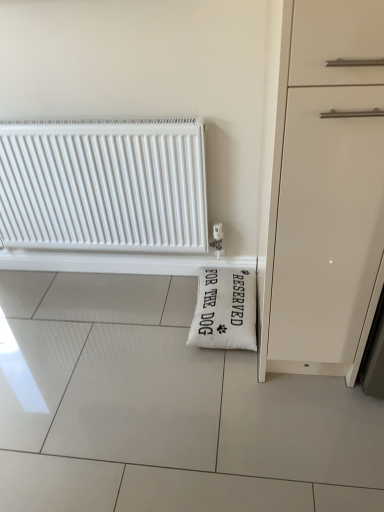
This screenshot has width=384, height=512. Describe the element at coordinates (104, 186) in the screenshot. I see `white plastic radiator at upper left` at that location.

At what (x,y) coordinates should I click in order to perform the action: click on white plastic radiator at upper left. Please return your answer as a coordinate pair (x, y). This screenshot has height=512, width=384. Looking at the image, I should click on (104, 186).

Identify the location of white fabric pillow at lower right. The height and width of the screenshot is (512, 384). (225, 310).

What do you see at coordinates (225, 310) in the screenshot? The width and height of the screenshot is (384, 512). I see `white fabric pillow at lower right` at bounding box center [225, 310].

Looking at this image, measure the distance between white fabric pillow at lower right and camera.

A distance of 5.60 feet exists between white fabric pillow at lower right and camera.

Measure the distance between point (208, 313) and camera.

A distance of 5.85 feet exists between point (208, 313) and camera.

The height and width of the screenshot is (512, 384). What are the coordinates of `white plastic radiator at upper left` in the screenshot? It's located at (104, 186).

Considering the relative positions of white fabric pillow at lower right and white plastic radiator at upper left in the image provided, is white fabric pillow at lower right to the left of white plastic radiator at upper left from the viewer's perspective?

In fact, white fabric pillow at lower right is to the right of white plastic radiator at upper left.

Between white fabric pillow at lower right and white plastic radiator at upper left, which one is positioned behind?

white fabric pillow at lower right is further from the camera.

Between point (234, 273) and point (116, 243), which one is positioned behind?

The point (116, 243) is more distant.

From the image's perspective, who appears lower, white fabric pillow at lower right or white plastic radiator at upper left?

From the image's view, white fabric pillow at lower right is below.

From a real-world perspective, which object stands above the other?

white plastic radiator at upper left.

Considering the relative sizes of white fabric pillow at lower right and white plastic radiator at upper left in the image provided, is white fabric pillow at lower right wider than white plastic radiator at upper left?

Yes.

From their relative heights in the image, would you say white fabric pillow at lower right is taller or shorter than white plastic radiator at upper left?

Considering their sizes, white fabric pillow at lower right has less height than white plastic radiator at upper left.

Looking at the image, does white fabric pillow at lower right seem bigger or smaller compared to white plastic radiator at upper left?

white fabric pillow at lower right is smaller than white plastic radiator at upper left.

Is white fabric pillow at lower right situated inside white plastic radiator at upper left or outside?

white fabric pillow at lower right is not inside white plastic radiator at upper left, it's outside.

Are white fabric pillow at lower right and white plastic radiator at upper left beside each other?

No, white fabric pillow at lower right is not next to white plastic radiator at upper left.

Is white fabric pillow at lower right looking in the opposite direction of white plastic radiator at upper left?

No, white fabric pillow at lower right is not facing away from white plastic radiator at upper left.

Where is `doormat that appears on the right of white plastic radiator at upper left`? doormat that appears on the right of white plastic radiator at upper left is located at coordinates tap(225, 310).

Considering the relative positions of white plastic radiator at upper left and white fabric pillow at lower right in the image provided, is white plastic radiator at upper left to the right of white fabric pillow at lower right from the viewer's perspective?

Incorrect, white plastic radiator at upper left is not on the right side of white fabric pillow at lower right.

Which object is closer to the camera, white plastic radiator at upper left or white fabric pillow at lower right?

white plastic radiator at upper left is more forward.

Is point (56, 159) farther from viewer compared to point (213, 283)?

No, it is not.

From the image's perspective, relative to white fabric pillow at lower right, is white plastic radiator at upper left above or below?

white plastic radiator at upper left is above white fabric pillow at lower right.

From a real-world perspective, is white plastic radiator at upper left physically located above or below white fabric pillow at lower right?

From a real-world perspective, white plastic radiator at upper left is physically above white fabric pillow at lower right.

Is white plastic radiator at upper left thinner than white fabric pillow at lower right?

Correct, the width of white plastic radiator at upper left is less than that of white fabric pillow at lower right.

Considering the relative sizes of white plastic radiator at upper left and white fabric pillow at lower right in the image provided, is white plastic radiator at upper left shorter than white fabric pillow at lower right?

No.

Is white plastic radiator at upper left bigger or smaller than white fabric pillow at lower right?

Clearly, white plastic radiator at upper left is larger in size than white fabric pillow at lower right.

Is white plastic radiator at upper left inside or outside of white fabric pillow at lower right?

white plastic radiator at upper left lies outside white fabric pillow at lower right.

Would you consider white plastic radiator at upper left to be distant from white fabric pillow at lower right?

That's not correct — white plastic radiator at upper left is a little close to white fabric pillow at lower right.

Could you tell me if white plastic radiator at upper left is turned towards white fabric pillow at lower right?

No, white plastic radiator at upper left is not turned towards white fabric pillow at lower right.

How distant is white plastic radiator at upper left from white fabric pillow at lower right?

white plastic radiator at upper left is 20.68 inches away from white fabric pillow at lower right.

The height and width of the screenshot is (512, 384). Identify the location of radiator above the white fabric pillow at lower right (from a real-world perspective). (104, 186).

The width and height of the screenshot is (384, 512). I want to click on radiator above the white fabric pillow at lower right (from the image's perspective), so click(104, 186).

Find the location of a particular element. The height and width of the screenshot is (512, 384). doormat lying below the white plastic radiator at upper left (from the image's perspective) is located at coordinates (225, 310).